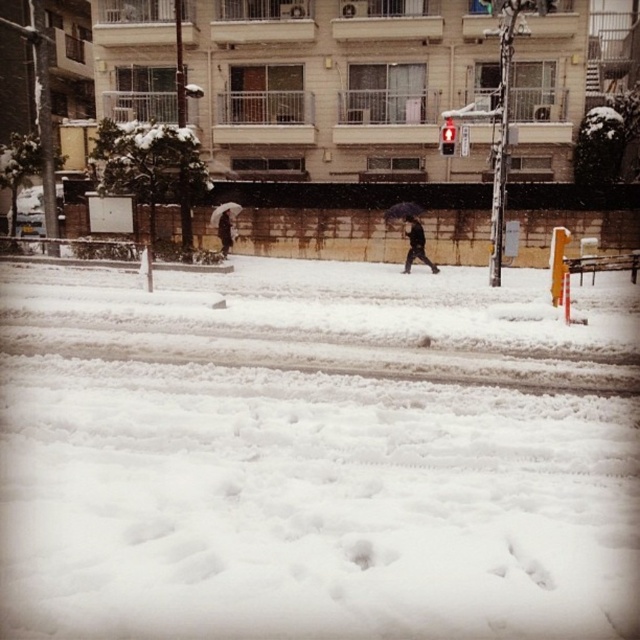
Between dark gray fabric umbrella at center and white matte umbrella at center, which one appears on the left side from the viewer's perspective?

Positioned to the left is dark gray fabric umbrella at center.

Can you confirm if dark gray fabric umbrella at center is taller than white matte umbrella at center?

Indeed, dark gray fabric umbrella at center has a greater height compared to white matte umbrella at center.

The image size is (640, 640). Describe the element at coordinates (225, 230) in the screenshot. I see `dark gray fabric umbrella at center` at that location.

Image resolution: width=640 pixels, height=640 pixels. I want to click on dark gray fabric umbrella at center, so click(225, 230).

Can you confirm if white fluffy snow at center is shorter than dark brown leather jacket at center?

In fact, white fluffy snow at center may be taller than dark brown leather jacket at center.

Which is behind, point (180, 316) or point (410, 216)?

Positioned behind is point (410, 216).

What are the coordinates of `white fluffy snow at center` in the screenshot? It's located at (316, 452).

Image resolution: width=640 pixels, height=640 pixels. I want to click on white fluffy snow at center, so click(316, 452).

Locate an element on the screen. This screenshot has width=640, height=640. white fluffy snow at center is located at coordinates (316, 452).